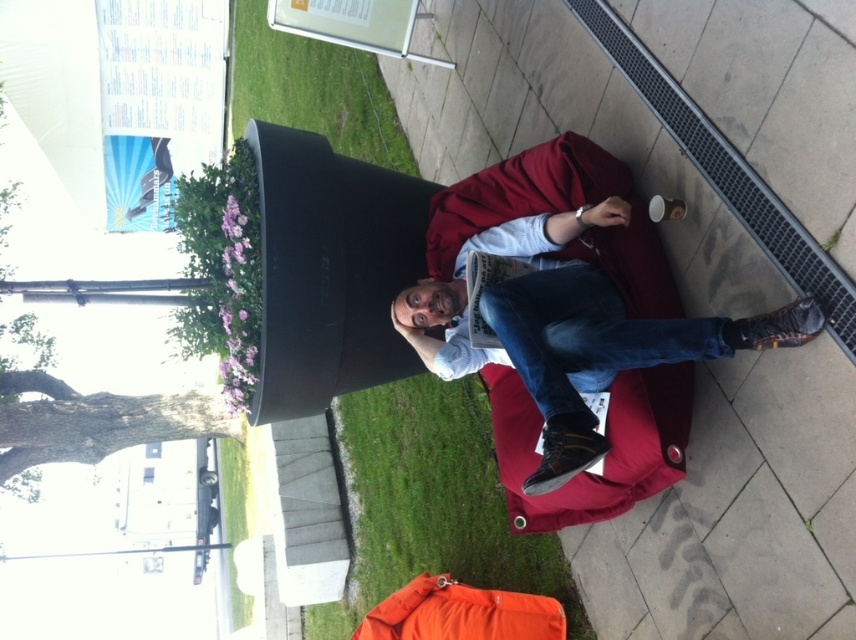
Can you confirm if matte black couch at lower right is wider than green grass at lower left?

Correct, the width of matte black couch at lower right exceeds that of green grass at lower left.

Can you confirm if matte black couch at lower right is bigger than green grass at lower left?

Indeed, matte black couch at lower right has a larger size compared to green grass at lower left.

Where is `matte black couch at lower right`? This screenshot has width=856, height=640. matte black couch at lower right is located at coordinates (572, 330).

Find the location of `matte black couch at lower right`. matte black couch at lower right is located at coordinates (572, 330).

Can you confirm if matte black couch at lower right is positioned above green grass at upper left?

Actually, matte black couch at lower right is below green grass at upper left.

Measure the distance between point (580,323) and camera.

Point (580,323) is 14.73 feet from camera.

Between point (465, 364) and point (321, 52), which one is positioned behind?

The point (321, 52) is behind.

This screenshot has width=856, height=640. Find the location of `matte black couch at lower right`. matte black couch at lower right is located at coordinates (572, 330).

Can you confirm if green grass at lower left is bigger than green grass at upper left?

No, green grass at lower left is not bigger than green grass at upper left.

Based on the photo, does green grass at lower left have a lesser width compared to green grass at upper left?

Yes, green grass at lower left is thinner than green grass at upper left.

Which is behind, point (443, 412) or point (288, 80)?

The point (288, 80) is behind.

I want to click on green grass at lower left, so (431, 502).